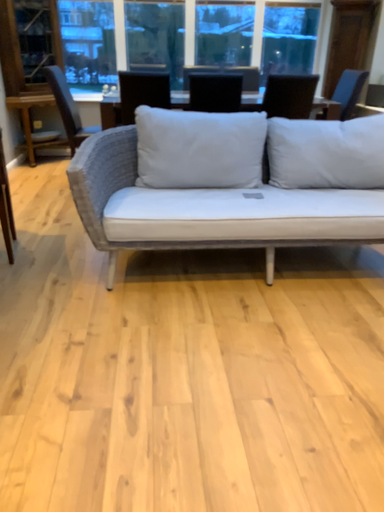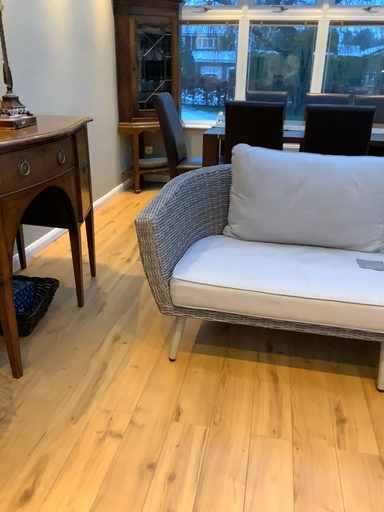
Question: Which way did the camera rotate in the video?

Choices:
 (A) rotated left
 (B) rotated right

Answer: (A)